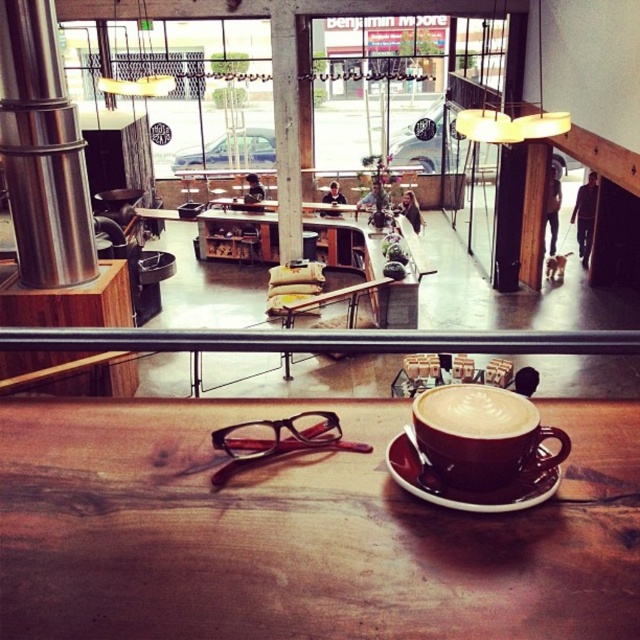
You are standing at point (x=468, y=416) and want to walk to the exit located at point (x=115, y=612). Is the exit directly in front of you or behind you?

The exit at point (x=115, y=612) is in front of you because it is located in front of point (x=468, y=416) where you are standing.

You are a customer sitting at the wooden table in the foreground of the cafe. You want to reach the point marked as point (x=497, y=429) and point (x=456, y=497). Which point is closer to your current position?

Point (x=497, y=429) is in front of point (x=456, y=497), so the point (x=497, y=429) is closer to your current position at the wooden table in the foreground.